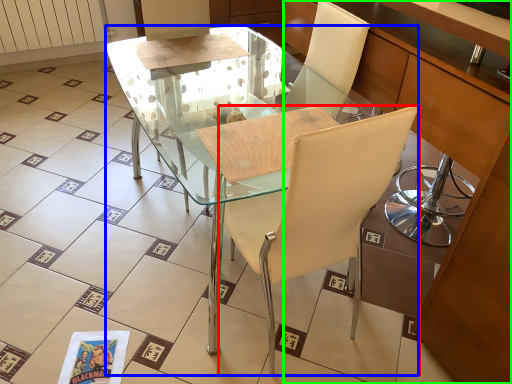
Question: Which object is positioned closest to chair (highlighted by a red box)? Select from desk (highlighted by a blue box) and cabinetry (highlighted by a green box).

Choices:
 (A) desk
 (B) cabinetry

Answer: (A)